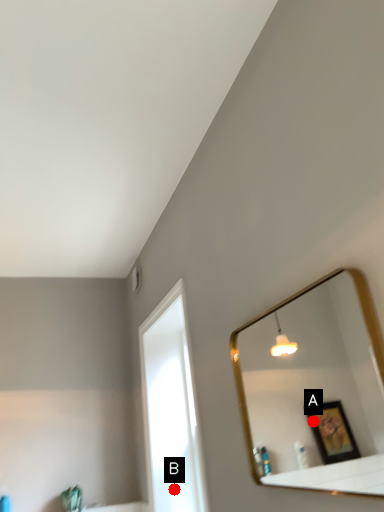
Question: Two points are circled on the image, labeled by A and B beside each circle. Which point appears closest to the camera in this image?

Choices:
 (A) A is closer
 (B) B is closer

Answer: (B)